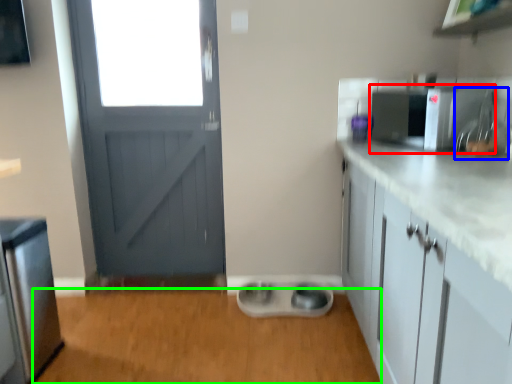
Question: Considering the real-world distances, which object is closest to appliance (highlighted by a red box)? sink (highlighted by a blue box) or plain (highlighted by a green box).

Choices:
 (A) sink
 (B) plain

Answer: (A)